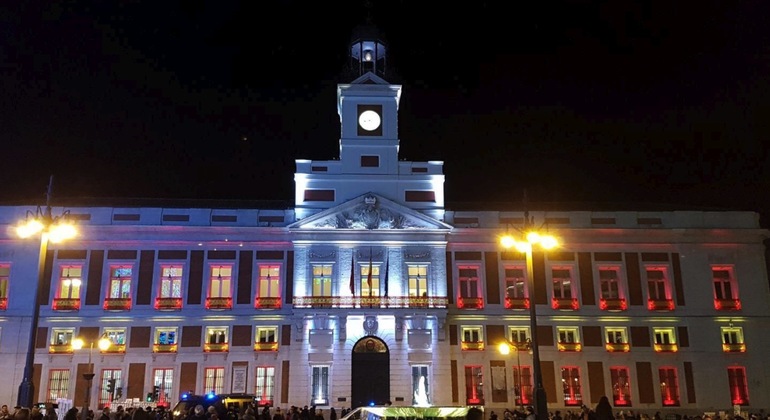
Where is `windows second floor`? The height and width of the screenshot is (420, 770). windows second floor is located at coordinates (62, 337), (112, 334), (215, 335), (258, 337), (469, 332), (517, 334), (564, 336), (620, 336), (671, 334), (732, 334).